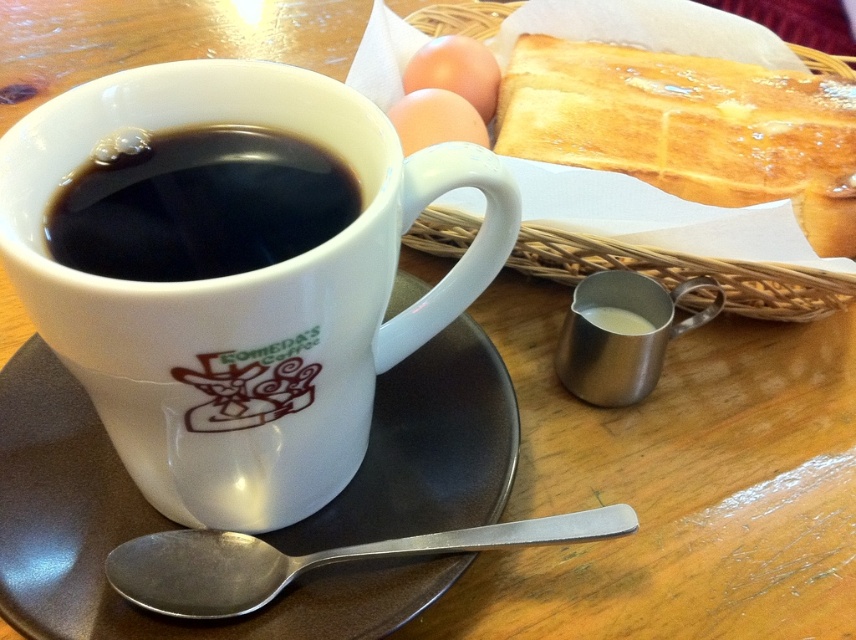
Question: Does golden brown toasted bread at upper right appear on the right side of black glossy coffee cup at center?

Choices:
 (A) yes
 (B) no

Answer: (A)

Question: Among these points, which one is nearest to the camera?

Choices:
 (A) (479, 67)
 (B) (141, 244)

Answer: (B)

Question: Is golden brown toasted bread at upper right smaller than silver metallic spoon at lower center?

Choices:
 (A) no
 (B) yes

Answer: (A)

Question: Which of the following is the closest to the observer?

Choices:
 (A) (464, 92)
 (B) (453, 417)

Answer: (B)

Question: From the image, what is the correct spatial relationship of golden brown toasted bread at upper right in relation to metallic silver creamer at upper right?

Choices:
 (A) below
 (B) above

Answer: (B)

Question: Among these points, which one is farthest from the camera?

Choices:
 (A) (383, 268)
 (B) (195, 556)
 (C) (592, 353)
 (D) (33, 378)

Answer: (C)